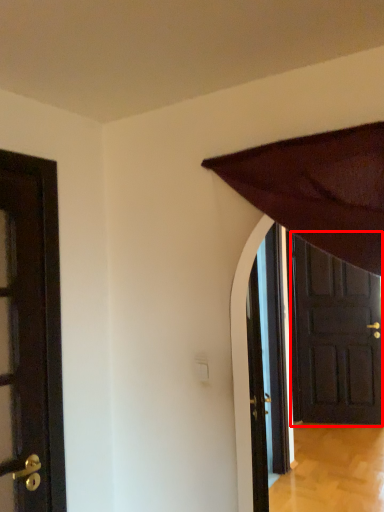
Question: From the image's perspective, where is door (annotated by the red box) located in relation to door in the image?

Choices:
 (A) below
 (B) above

Answer: (A)